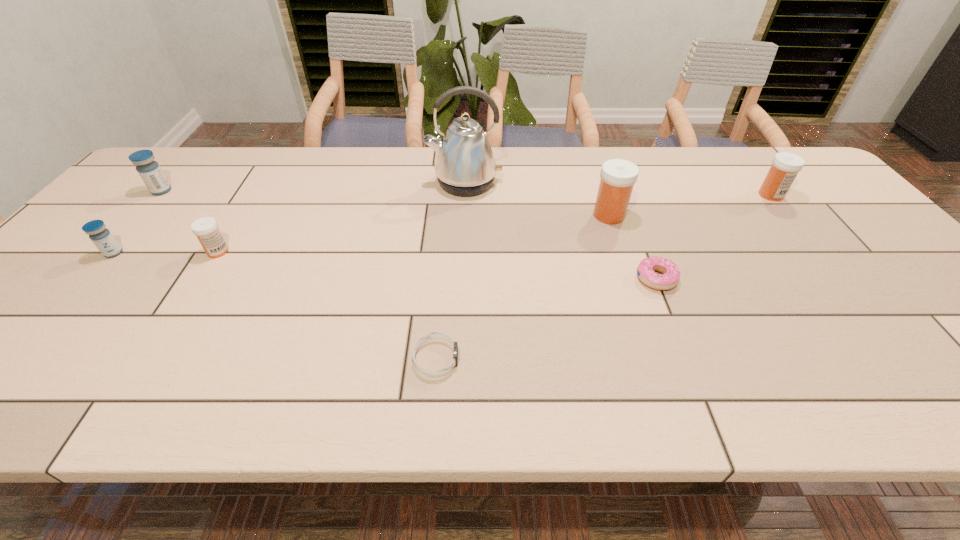
This screenshot has height=540, width=960. Identify the location of kettle. (465, 165).

You are a GUI agent. You are given a task and a screenshot of the screen. Output one action in this format:
    pyautogui.click(x=<x>, y=<y>)
    Task: Click on the biggest white medicine
    
    Given the screenshot: What is the action you would take?
    pyautogui.click(x=618, y=176)

The image size is (960, 540). Identify the location of the fourth medicine from left to right. (618, 176).

You are a GUI agent. You are given a task and a screenshot of the screen. Output one action in this format:
    pyautogui.click(x=<x>, y=<y>)
    Task: Click on the farther blue medicine
    This screenshot has width=960, height=540.
    Given the screenshot: What is the action you would take?
    pyautogui.click(x=149, y=170)

This screenshot has width=960, height=540. What are the coordinates of `the second biggest white medicine` in the screenshot? It's located at (785, 166).

This screenshot has width=960, height=540. I want to click on the rightmost object, so click(x=785, y=166).

The height and width of the screenshot is (540, 960). In order to click on the third medicine from left to right in this screenshot , I will do pyautogui.click(x=206, y=229).

Where is `the nearest white medicine`? Image resolution: width=960 pixels, height=540 pixels. the nearest white medicine is located at coordinates (206, 229).

Locate an element on the screen. The width and height of the screenshot is (960, 540). the smaller blue medicine is located at coordinates (102, 238).

This screenshot has width=960, height=540. I want to click on pink doughnut, so click(669, 278).